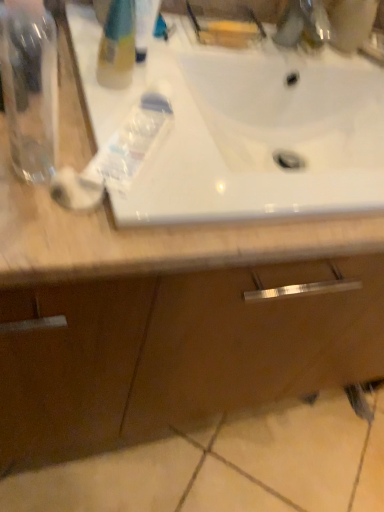
Question: Should I look upward or downward to see translucent plastic bottle at upper left?

Choices:
 (A) up
 (B) down

Answer: (A)

Question: From the image's perspective, is transparent plastic bottle at left below translucent plastic bottle at upper left?

Choices:
 (A) no
 (B) yes

Answer: (B)

Question: Is transparent plastic bottle at left taller than translucent plastic bottle at upper left?

Choices:
 (A) no
 (B) yes

Answer: (B)

Question: Is transparent plastic bottle at left not inside translucent plastic bottle at upper left?

Choices:
 (A) yes
 (B) no

Answer: (A)

Question: Does transparent plastic bottle at left have a smaller size compared to translucent plastic bottle at upper left?

Choices:
 (A) no
 (B) yes

Answer: (B)

Question: Does transparent plastic bottle at left have a lesser width compared to translucent plastic bottle at upper left?

Choices:
 (A) no
 (B) yes

Answer: (B)

Question: Can you confirm if transparent plastic bottle at left is bigger than translucent plastic bottle at upper left?

Choices:
 (A) no
 (B) yes

Answer: (A)

Question: Is metallic faucet at upper right a part of translucent plastic toothpaste at center?

Choices:
 (A) no
 (B) yes

Answer: (A)

Question: Can you confirm if translucent plastic toothpaste at center is positioned to the left of metallic faucet at upper right?

Choices:
 (A) yes
 (B) no

Answer: (A)

Question: Is translucent plastic toothpaste at center further to the viewer compared to metallic faucet at upper right?

Choices:
 (A) yes
 (B) no

Answer: (B)

Question: Does translucent plastic toothpaste at center have a greater height compared to metallic faucet at upper right?

Choices:
 (A) yes
 (B) no

Answer: (B)

Question: Does translucent plastic toothpaste at center turn towards metallic faucet at upper right?

Choices:
 (A) yes
 (B) no

Answer: (B)

Question: Considering the relative sizes of translucent plastic toothpaste at center and metallic faucet at upper right in the image provided, is translucent plastic toothpaste at center bigger than metallic faucet at upper right?

Choices:
 (A) yes
 (B) no

Answer: (A)

Question: From a real-world perspective, does metallic faucet at upper right stand above translucent plastic bottle at upper left?

Choices:
 (A) yes
 (B) no

Answer: (B)